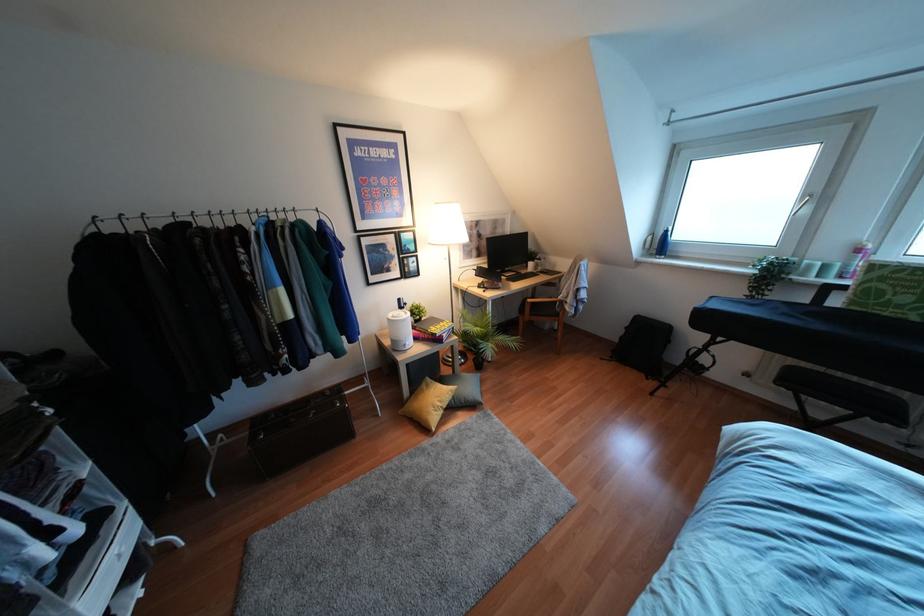
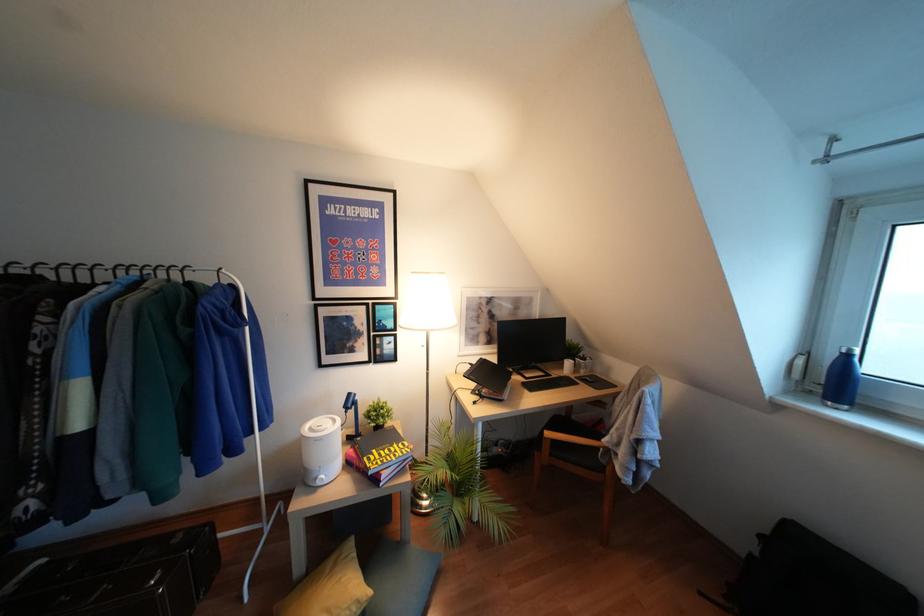
Question: The camera is either moving clockwise (left) or counter-clockwise (right) around the object. The first image is from the beginning of the video and the second image is from the end. Is the camera moving left or right when shooting the video?

Choices:
 (A) Left
 (B) Right

Answer: (B)